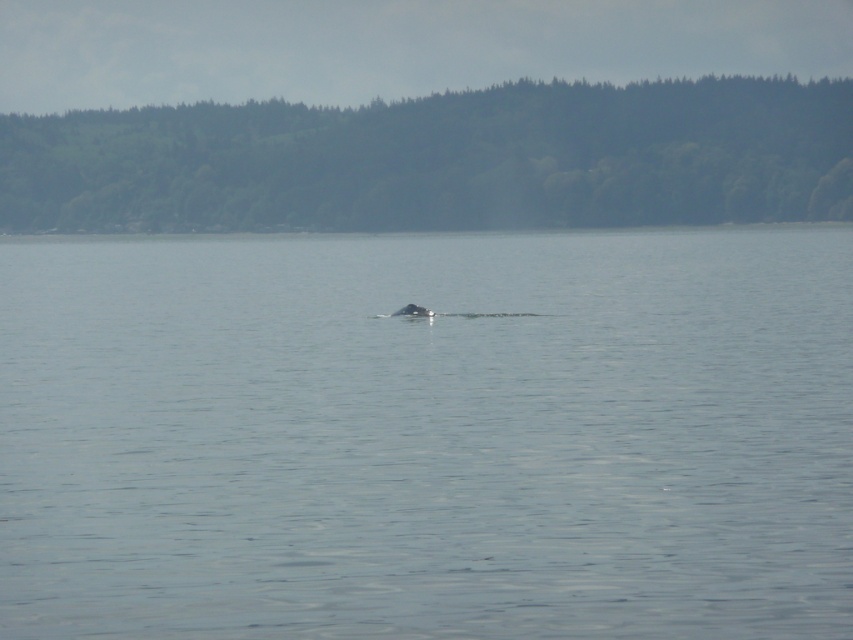
You are a marine biologist observing the image. You notice the clear water at center and the gray matte whale at center. Which object in the scene appears bigger?

The clear water at center appears bigger than the gray matte whale at center because the clear water at center has a larger size compared to gray matte whale at center.

You are a marine biologist observing the scene from a boat. You notice the clear water at center and the gray matte whale at center. Which object has a greater width in the image?

The clear water at center has a greater width than the gray matte whale at center according to the description.